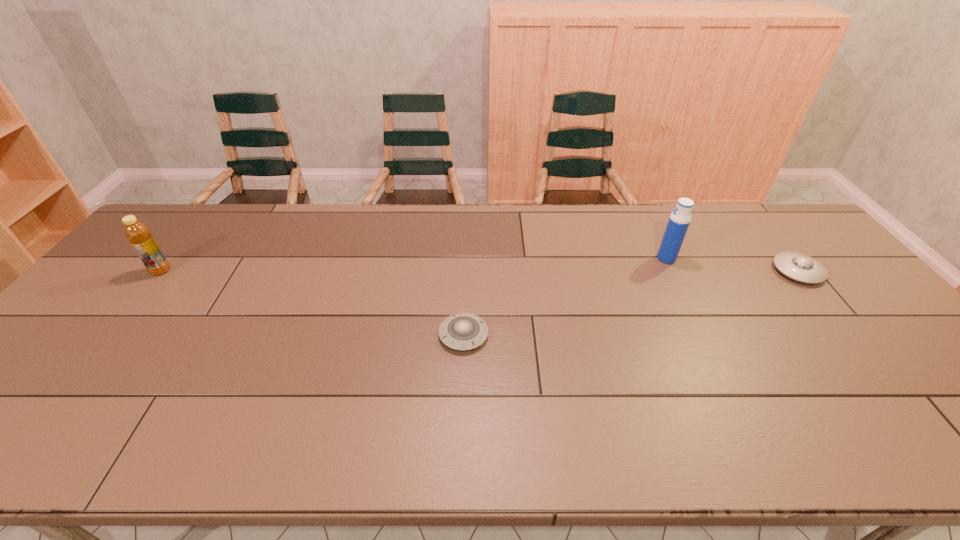
I want to click on vacant space in between the right saucer and the second object from left to right, so click(631, 303).

Where is `empty location between the shortest object and the water bottle`? This screenshot has height=540, width=960. empty location between the shortest object and the water bottle is located at coordinates coord(564,296).

What are the coordinates of `blank region between the farther saucer and the nearer saucer` in the screenshot? It's located at (631, 303).

Where is `free space between the water bottle and the shortest object`? free space between the water bottle and the shortest object is located at coordinates (564, 296).

Find the location of `vacant area that lies between the leftmost object and the shortest object`. vacant area that lies between the leftmost object and the shortest object is located at coordinates (312, 303).

Image resolution: width=960 pixels, height=540 pixels. Identify the location of object that ranks as the closest to the leftmost object. (463, 331).

Image resolution: width=960 pixels, height=540 pixels. What are the coordinates of `object that stands as the second closest to the nearer saucer` in the screenshot? It's located at (137, 233).

You are a GUI agent. You are given a task and a screenshot of the screen. Output one action in this format:
    pyautogui.click(x=<x>, y=<y>)
    Task: Click on the free space that satisfies the following two spatial constraints: 1. on the front side of the water bottle; 2. on the left side of the farther saucer
    Image resolution: width=960 pixels, height=540 pixels.
    Given the screenshot: What is the action you would take?
    pyautogui.click(x=673, y=271)